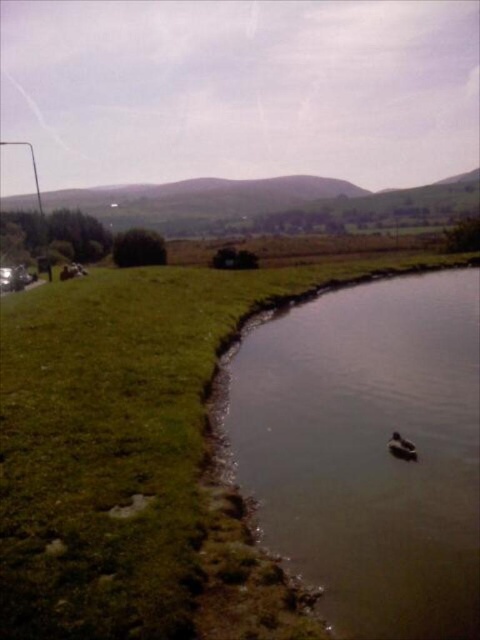
Is green matte lake at center taller than brown fuzzy duck at lower right?

Indeed, green matte lake at center has a greater height compared to brown fuzzy duck at lower right.

Does green matte lake at center lie behind brown fuzzy duck at lower right?

No, it is in front of brown fuzzy duck at lower right.

Which is in front, point (333, 298) or point (411, 458)?

Point (411, 458)

Find the location of a particular element. The width and height of the screenshot is (480, 640). green matte lake at center is located at coordinates (365, 449).